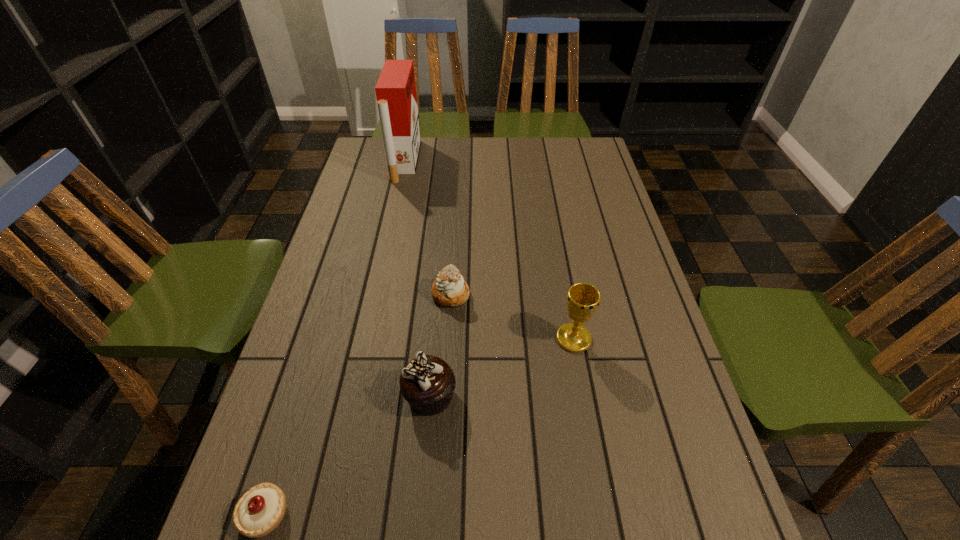
Find the location of a particular element. the tallest object is located at coordinates (395, 90).

Where is `the fourth object from right to left`? the fourth object from right to left is located at coordinates (395, 90).

This screenshot has height=540, width=960. Find the location of `chalice`. chalice is located at coordinates (583, 299).

At what (x,y) coordinates should I click in order to perform the action: click on the third farthest object. Please return your answer as a coordinate pair (x, y). The height and width of the screenshot is (540, 960). Looking at the image, I should click on (583, 299).

Where is `cupcake`? This screenshot has height=540, width=960. cupcake is located at coordinates (427, 383).

The image size is (960, 540). Identify the location of the second nearest object. tap(427, 383).

You are a GUI agent. You are given a task and a screenshot of the screen. Output one action in this format:
    pyautogui.click(x=<x>, y=<y>)
    Task: Click on the fourth tallest object
    
    Given the screenshot: What is the action you would take?
    pyautogui.click(x=449, y=289)

Where is `the fourth nearest object`? The width and height of the screenshot is (960, 540). the fourth nearest object is located at coordinates (449, 289).

At what (x,y) coordinates should I click in order to perform the action: click on vacant region located on the front-facing side of the second object from left to right. Please return your answer as a coordinate pair (x, y). The image size is (960, 540). Looking at the image, I should click on (506, 161).

Where is `free point located 0.340m on the left of the chalice`? The width and height of the screenshot is (960, 540). free point located 0.340m on the left of the chalice is located at coordinates click(414, 339).